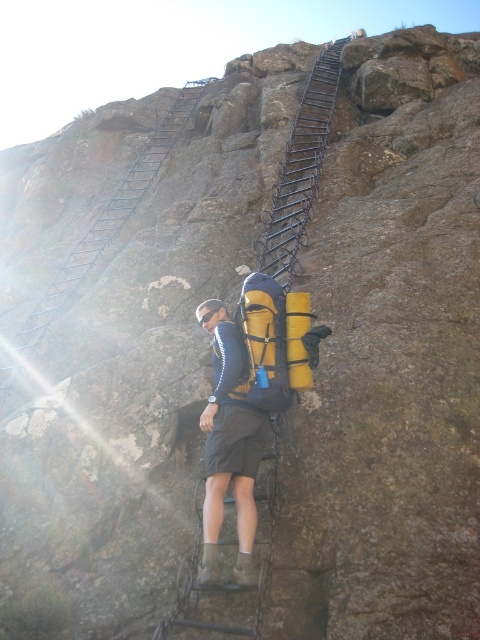
Question: Which point is farther from the camera taking this photo?

Choices:
 (A) coord(264,282)
 (B) coord(288,269)
 (C) coord(204,80)

Answer: (C)

Question: Estimate the real-world distances between objects in this image. Which object is closer to the metallic black ladder at upper left?

Choices:
 (A) yellow matte backpack at center
 (B) metallic black ladder at upper center
 (C) black metal ladder at center

Answer: (B)

Question: Based on their relative distances, which object is nearer to the metallic black ladder at upper center?

Choices:
 (A) metallic black ladder at upper left
 (B) matte yellow backpack at center
 (C) yellow matte backpack at center

Answer: (A)

Question: Is the position of metallic black ladder at upper center less distant than that of yellow matte backpack at center?

Choices:
 (A) no
 (B) yes

Answer: (A)

Question: Can you confirm if black metal ladder at center is bigger than metallic black ladder at upper left?

Choices:
 (A) no
 (B) yes

Answer: (B)

Question: Does matte yellow backpack at center have a greater width compared to black metal ladder at center?

Choices:
 (A) yes
 (B) no

Answer: (B)